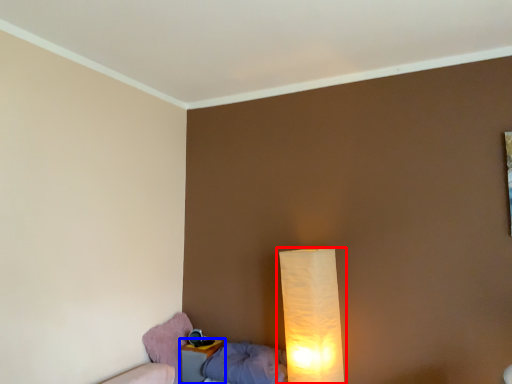
Question: Which object is closer to the camera taking this photo, lamp (highlighted by a red box) or nightstand (highlighted by a blue box)?

Choices:
 (A) lamp
 (B) nightstand

Answer: (A)